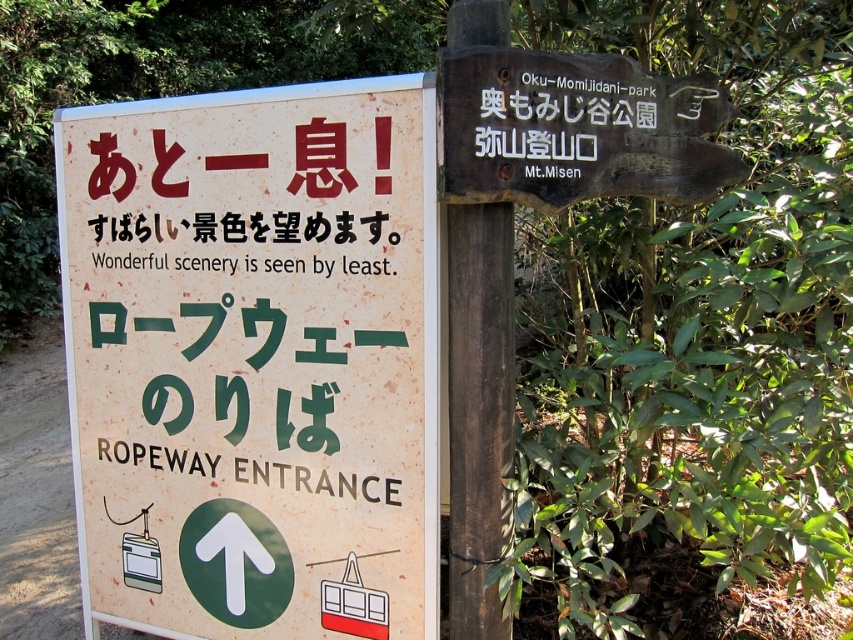
Question: Can you confirm if brown wooden signpost at upper right is wider than brown wooden signpost at upper center?

Choices:
 (A) yes
 (B) no

Answer: (A)

Question: Which point appears farthest from the camera in this image?

Choices:
 (A) (505, 428)
 (B) (364, 192)

Answer: (B)

Question: Is the position of beige paper sign at left more distant than that of brown wooden signpost at upper center?

Choices:
 (A) yes
 (B) no

Answer: (A)

Question: Is beige paper sign at left bigger than blackmaterial/texturetext at upper center?

Choices:
 (A) yes
 (B) no

Answer: (A)

Question: Which point is farther to the camera?

Choices:
 (A) (511, 173)
 (B) (265, 237)
 (C) (492, 332)

Answer: (B)

Question: Which point is farther to the camera?

Choices:
 (A) (329, 237)
 (B) (602, 54)
 (C) (392, 116)
 (D) (451, 422)

Answer: (A)